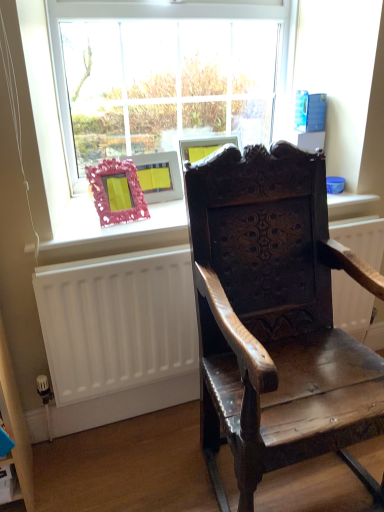
Where is `vacant space underneath white matte radiator at lower left (from a real-world perspective)`? Image resolution: width=384 pixels, height=512 pixels. vacant space underneath white matte radiator at lower left (from a real-world perspective) is located at coordinates (151, 421).